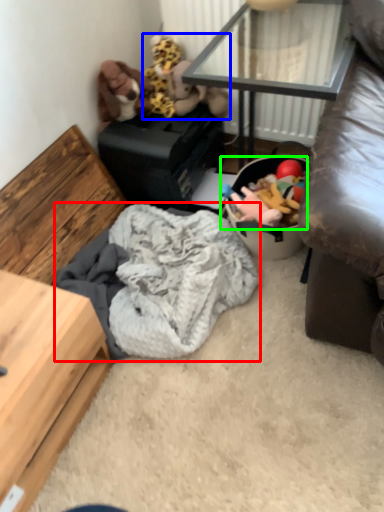
Question: Based on their relative distances, which object is farther from clothing (highlighted by a red box)? Choose from toy (highlighted by a blue box) and stuff (highlighted by a green box).

Choices:
 (A) toy
 (B) stuff

Answer: (A)